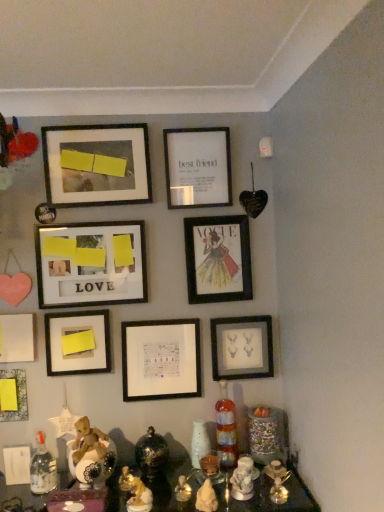
Question: Does matte wooden picture frame at center-left, which ranks as the 4th picture frame in top-to-bottom order, touch white matte picture frame at upper center, which is the 9th picture frame from bottom to top?

Choices:
 (A) yes
 (B) no

Answer: (B)

Question: Is matte wooden picture frame at center-left, which ranks as the 4th picture frame in top-to-bottom order, shorter than white matte picture frame at upper center, the first picture frame viewed from the top?

Choices:
 (A) no
 (B) yes

Answer: (A)

Question: Is matte wooden picture frame at center-left, positioned as the sixth picture frame in bottom-to-top order, positioned far away from white matte picture frame at upper center, the first picture frame viewed from the top?

Choices:
 (A) no
 (B) yes

Answer: (A)

Question: Is matte wooden picture frame at center-left, positioned as the sixth picture frame in bottom-to-top order, outside white matte picture frame at upper center, the first picture frame viewed from the top?

Choices:
 (A) no
 (B) yes

Answer: (B)

Question: Is white matte picture frame at upper center, the first picture frame viewed from the top, a part of matte wooden picture frame at center-left, positioned as the sixth picture frame in bottom-to-top order?

Choices:
 (A) no
 (B) yes

Answer: (A)

Question: From the image's perspective, is matte black picture frame at center, positioned as the third picture frame in top-to-bottom order, located above or below white matte paper at lower left, which ranks as the 5th picture frame in top-to-bottom order?

Choices:
 (A) below
 (B) above

Answer: (B)

Question: Is matte black picture frame at center, the seventh picture frame when ordered from bottom to top, wider or thinner than white matte paper at lower left, which ranks as the 5th picture frame in top-to-bottom order?

Choices:
 (A) thin
 (B) wide

Answer: (A)

Question: From a real-world perspective, is matte black picture frame at center, positioned as the third picture frame in top-to-bottom order, positioned above or below white matte paper at lower left, which ranks as the 5th picture frame in top-to-bottom order?

Choices:
 (A) above
 (B) below

Answer: (A)

Question: Looking at the image, does matte black picture frame at center, positioned as the third picture frame in top-to-bottom order, seem bigger or smaller compared to white matte paper at lower left, marked as the 5th picture frame in a bottom-to-top arrangement?

Choices:
 (A) small
 (B) big

Answer: (B)

Question: From a real-world perspective, relative to translucent glass candle holder at center, is matte wooden picture frame at center-left, which ranks as the 4th picture frame in top-to-bottom order, vertically above or below?

Choices:
 (A) above
 (B) below

Answer: (A)

Question: In the image, is matte wooden picture frame at center-left, positioned as the sixth picture frame in bottom-to-top order, positioned in front of or behind translucent glass candle holder at center?

Choices:
 (A) behind
 (B) front

Answer: (A)

Question: Is point (135, 268) positioned closer to the camera than point (205, 460)?

Choices:
 (A) closer
 (B) farther

Answer: (B)

Question: From their relative heights in the image, would you say matte wooden picture frame at center-left, which ranks as the 4th picture frame in top-to-bottom order, is taller or shorter than translucent glass candle holder at center?

Choices:
 (A) tall
 (B) short

Answer: (A)

Question: Is translucent glass bottle at lower right, the second bottle viewed from the left, wider or thinner than yellow matte paper at lower left, positioned as the fourth picture frame in bottom-to-top order?

Choices:
 (A) thin
 (B) wide

Answer: (B)

Question: From the image's perspective, is translucent glass bottle at lower right, the 2th bottle positioned from the front, positioned above or below yellow matte paper at lower left, acting as the sixth picture frame starting from the top?

Choices:
 (A) below
 (B) above

Answer: (A)